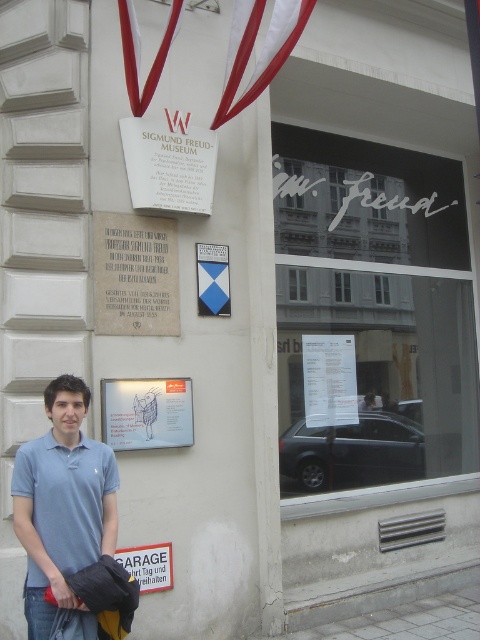
Does light blue polo shirt at lower left have a greater width compared to blue fabric flag at center?

Indeed, light blue polo shirt at lower left has a greater width compared to blue fabric flag at center.

Does light blue polo shirt at lower left have a lesser width compared to blue fabric flag at center?

In fact, light blue polo shirt at lower left might be wider than blue fabric flag at center.

Find the location of a particular element. light blue polo shirt at lower left is located at coordinates (62, 506).

Locate an element on the screen. light blue polo shirt at lower left is located at coordinates (62, 506).

Is white paper at center shorter than blue fabric flag at center?

In fact, white paper at center may be taller than blue fabric flag at center.

Which of these two, white paper at center or blue fabric flag at center, stands taller?

white paper at center is taller.

This screenshot has height=640, width=480. What do you see at coordinates (330, 380) in the screenshot?
I see `white paper at center` at bounding box center [330, 380].

You are a GUI agent. You are given a task and a screenshot of the screen. Output one action in this format:
    pyautogui.click(x=<x>, y=<y>)
    Task: Click on the white paper at center
    The image size is (480, 640).
    Given the screenshot: What is the action you would take?
    pyautogui.click(x=330, y=380)

Between white stone plaque at upper center and white paper plaque at upper center, which one is positioned lower?

white stone plaque at upper center

Who is taller, white stone plaque at upper center or white paper plaque at upper center?

Standing taller between the two is white stone plaque at upper center.

Which is in front, point (167, 333) or point (141, 147)?

Positioned in front is point (141, 147).

At what (x,y) coordinates should I click in order to perform the action: click on white stone plaque at upper center. Please return your answer as a coordinate pair (x, y). This screenshot has width=480, height=640. Looking at the image, I should click on (134, 275).